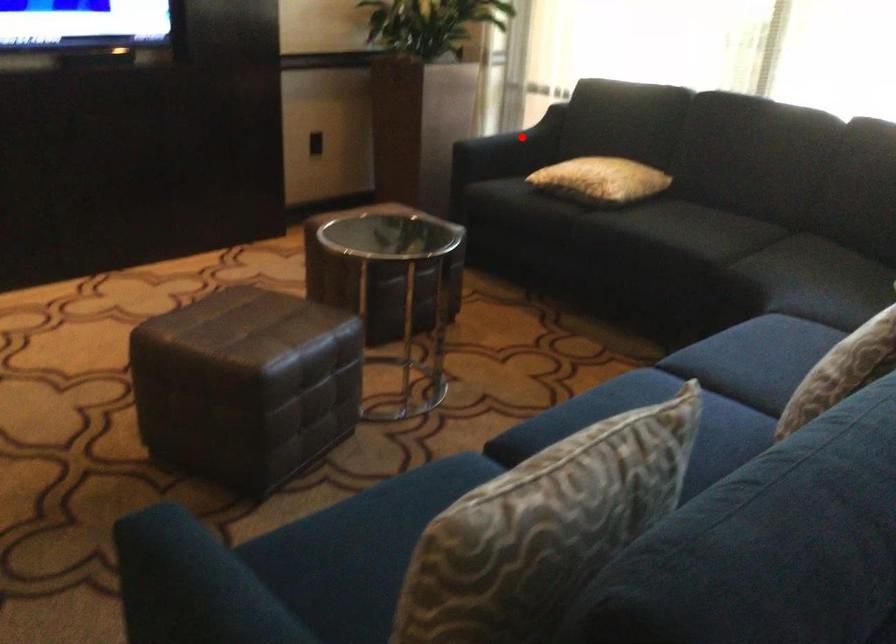
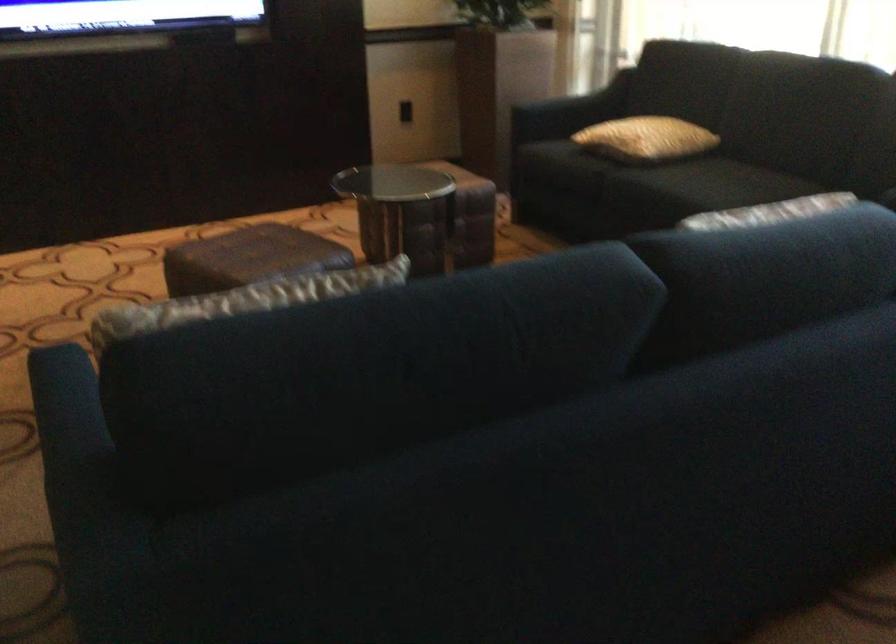
Find the pixel in the second image that matches the highlighted location in the first image.

(586, 99)